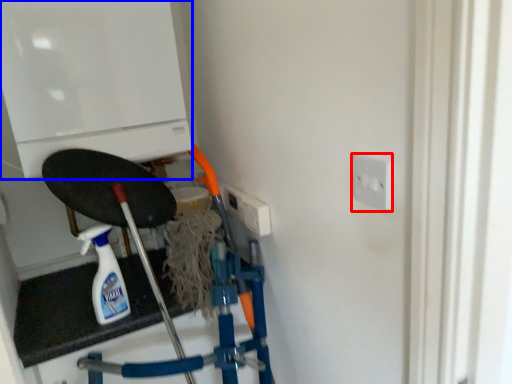
Question: Which object appears farthest to the camera in this image, socket (highlighted by a red box) or appliance (highlighted by a blue box)?

Choices:
 (A) socket
 (B) appliance

Answer: (B)